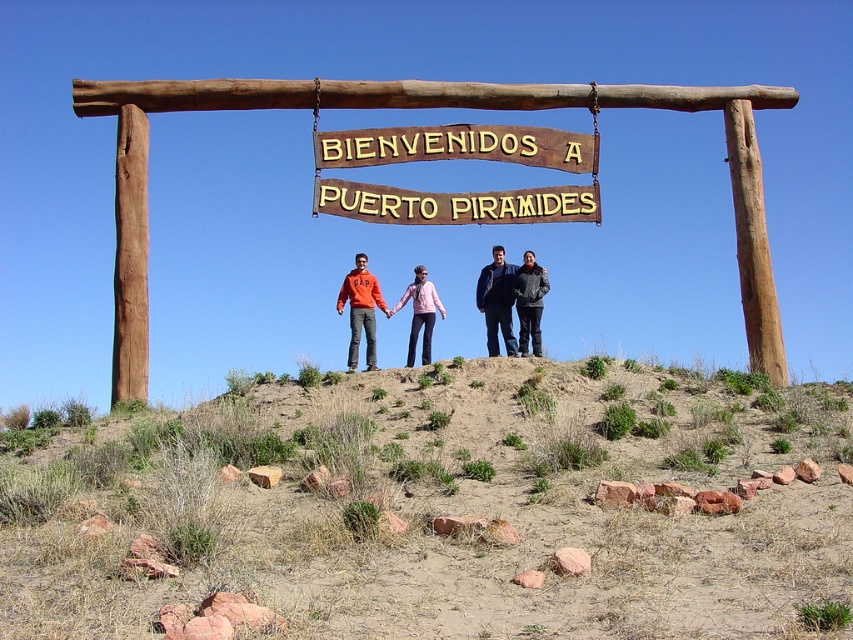
Question: Is the position of dark blue jacket at center more distant than that of matte pink jacket at center?

Choices:
 (A) no
 (B) yes

Answer: (A)

Question: Considering the real-world distances, which object is closest to the matte pink jacket at center?

Choices:
 (A) dark gray jacket at center
 (B) dried grass at center
 (C) orange cotton hoodie at center
 (D) wooden sign at center

Answer: (C)

Question: Can you confirm if dried grass at center is wider than dark blue jacket at center?

Choices:
 (A) no
 (B) yes

Answer: (B)

Question: Which point is closer to the camera taking this photo?

Choices:
 (A) (662, 397)
 (B) (368, 284)
 (C) (396, 301)

Answer: (A)

Question: Considering the relative positions of wooden sign at center and dark gray jacket at center in the image provided, where is wooden sign at center located with respect to dark gray jacket at center?

Choices:
 (A) above
 (B) below

Answer: (A)

Question: Considering the real-world distances, which object is closest to the wooden sign at center?

Choices:
 (A) orange cotton hoodie at center
 (B) dried grass at center

Answer: (A)